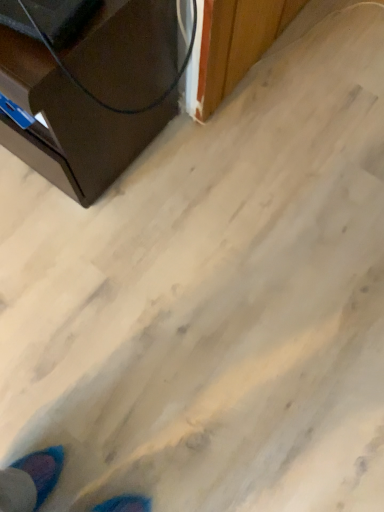
Measure the distance between point (67, 151) and camera.

A distance of 36.61 inches exists between point (67, 151) and camera.

This screenshot has width=384, height=512. I want to click on matte black speaker at upper left, so click(69, 123).

Describe the element at coordinates (69, 123) in the screenshot. The height and width of the screenshot is (512, 384). I see `matte black speaker at upper left` at that location.

Locate an element on the screen. The image size is (384, 512). matte black speaker at upper left is located at coordinates (69, 123).